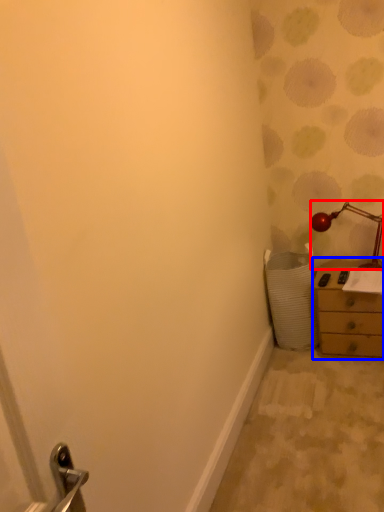
Question: Which object appears closest to the camera in this image, lamp (highlighted by a red box) or chest of drawers (highlighted by a blue box)?

Choices:
 (A) lamp
 (B) chest of drawers

Answer: (B)